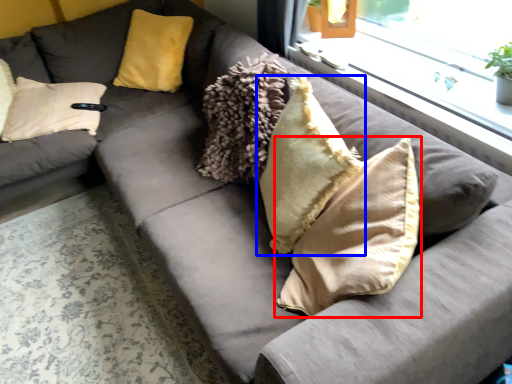
Question: Which point is closer to the camera, pillow (highlighted by a red box) or pillow (highlighted by a blue box)?

Choices:
 (A) pillow
 (B) pillow

Answer: (A)